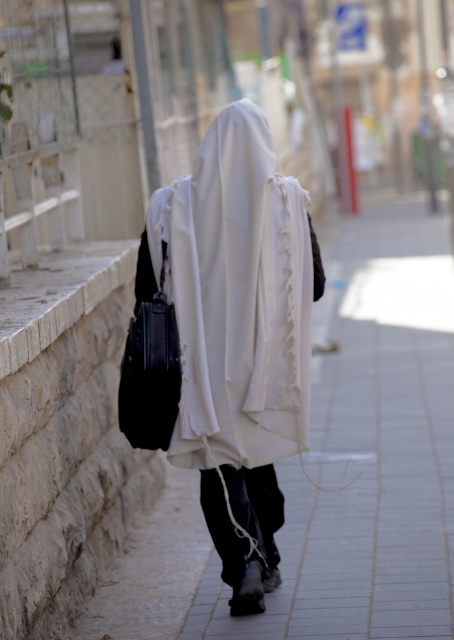
You are a photographer standing at the camera position. You want to capture a closeup shot of the white fabric at center. Considering your current distance, do you think you need to move closer or farther away?

The white fabric at center and camera are 6.04 meters apart from each other. To capture a closeup shot, you need to move closer.

You are standing on the street and see both the white fabric at center and the white fabric robe at center. Which one is positioned more to the right side?

The white fabric at center is positioned to the right of the white fabric robe at center, so the white fabric at center is more to the right.